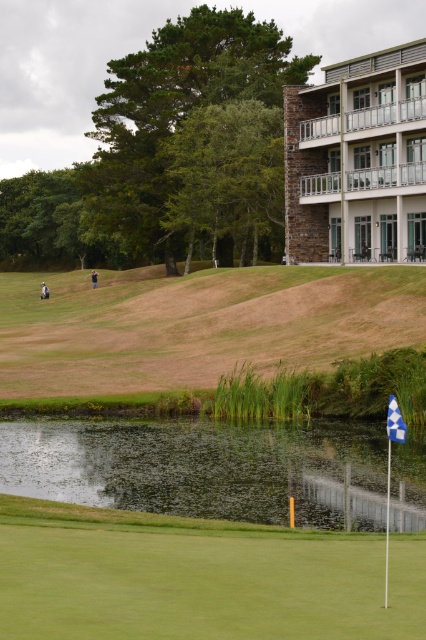
You are a golfer trying to hit your ball into the hole. You notice the green reflective water at lower center and the blue fabric flag at lower right. Which object is closer to you as you stand on the golf course?

The green reflective water at lower center is closer to you because it is further to the viewer than the blue fabric flag at lower right.

You are a golfer standing on the green grass at lower center and want to hit a ball to the flagstick. Since the green reflective water at lower center is in the way, will you have enough space to swing your club without hitting the water?

The green grass at lower center is smaller than the green reflective water at lower center, so the water is larger and might block your swing path. You may need to adjust your shot to avoid the water.